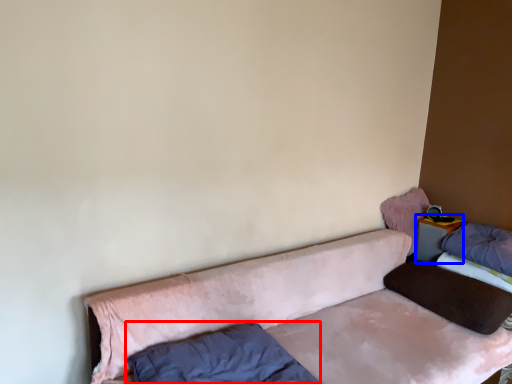
Question: Among these objects, which one is nearest to the camera, pillow (highlighted by a red box) or table (highlighted by a blue box)?

Choices:
 (A) pillow
 (B) table

Answer: (A)